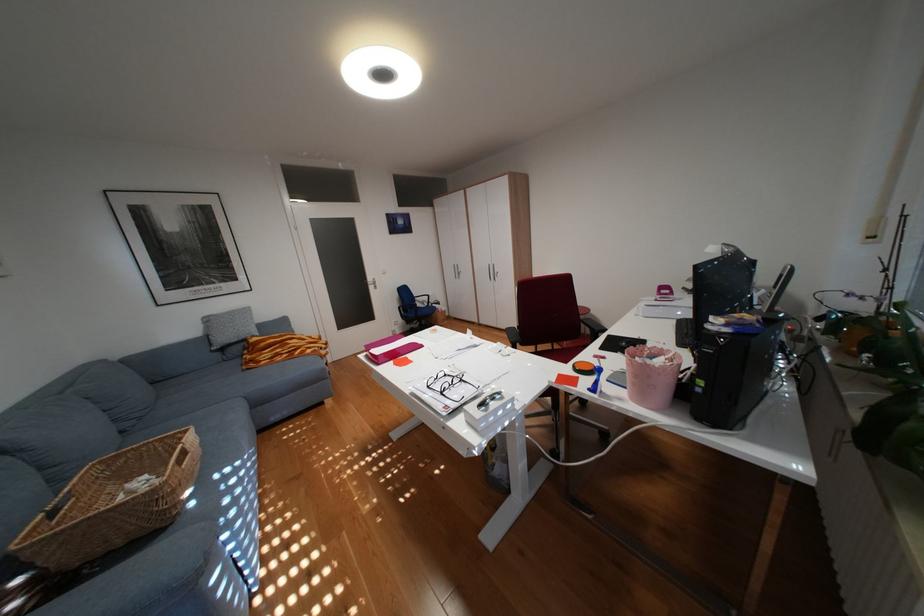
At what (x,y) coordinates should I click in order to perform the action: click on pink pencil holder. Please return your answer as a coordinate pair (x, y). The width and height of the screenshot is (924, 616). Looking at the image, I should click on (650, 375).